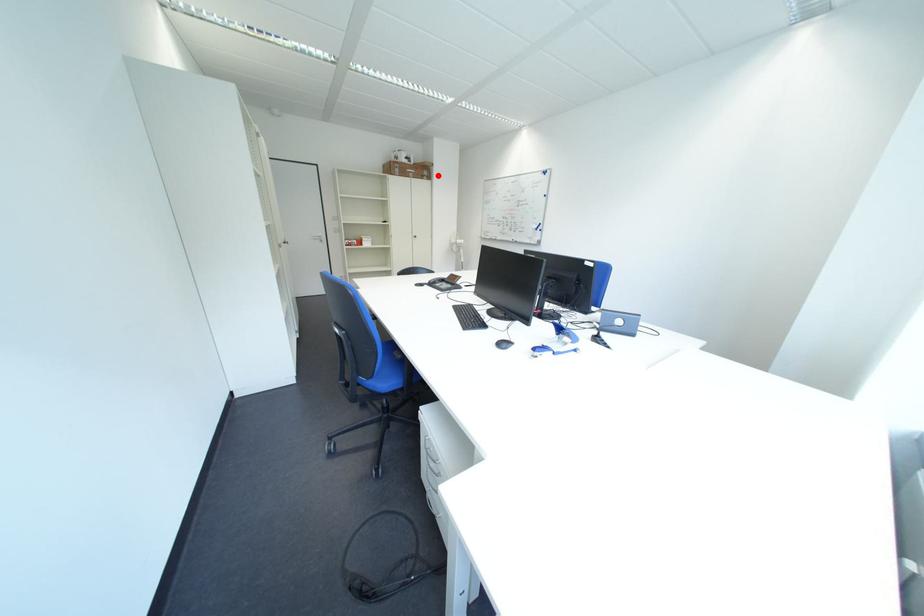
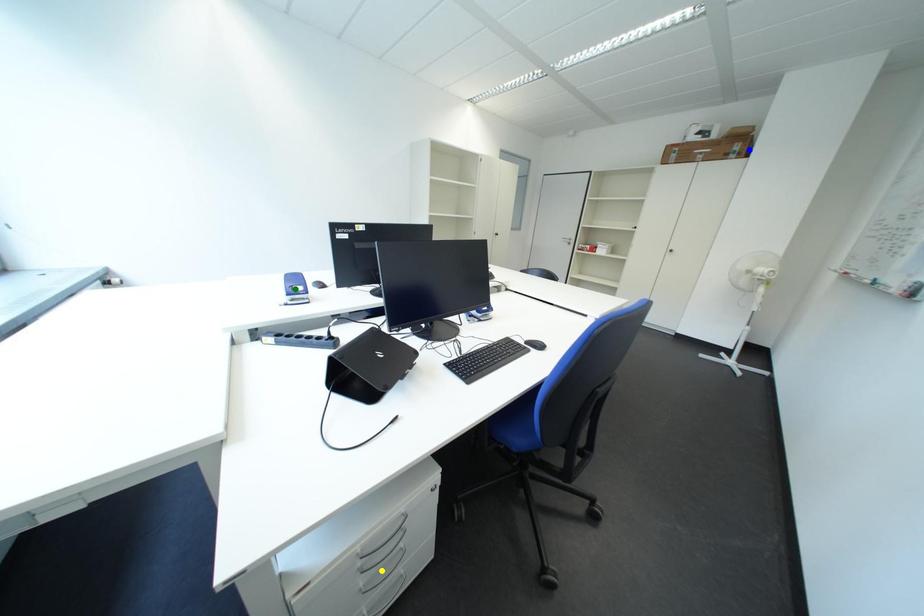
Question: I am providing you with two images of the same scene from different viewpoints. A red point is marked on the first image. You are given multiple points on the second image. Which point in image 2 is actually the same real-world point as the red point in image 1?

Choices:
 (A) yellow point
 (B) blue point
 (C) green point

Answer: (B)